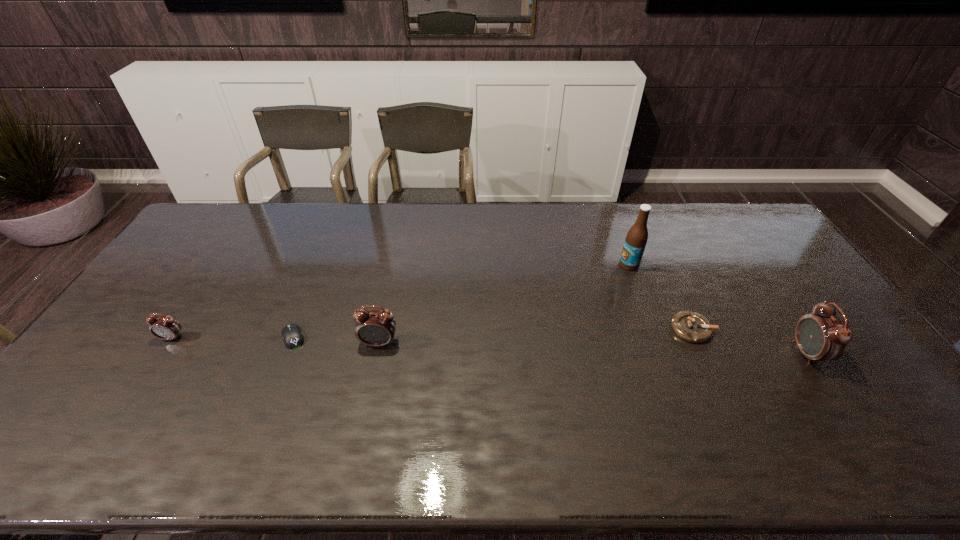
At what (x,y) coordinates should I click in order to perform the action: click on free space for an extra alarm_clock to achieve even spacing. Please return your answer as a coordinate pair (x, y). The height and width of the screenshot is (540, 960). Looking at the image, I should click on (591, 348).